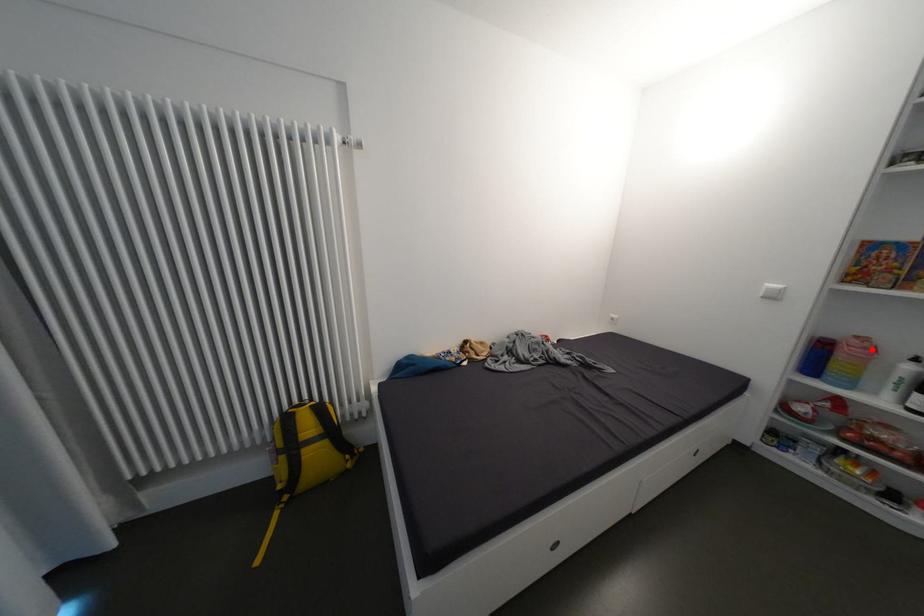
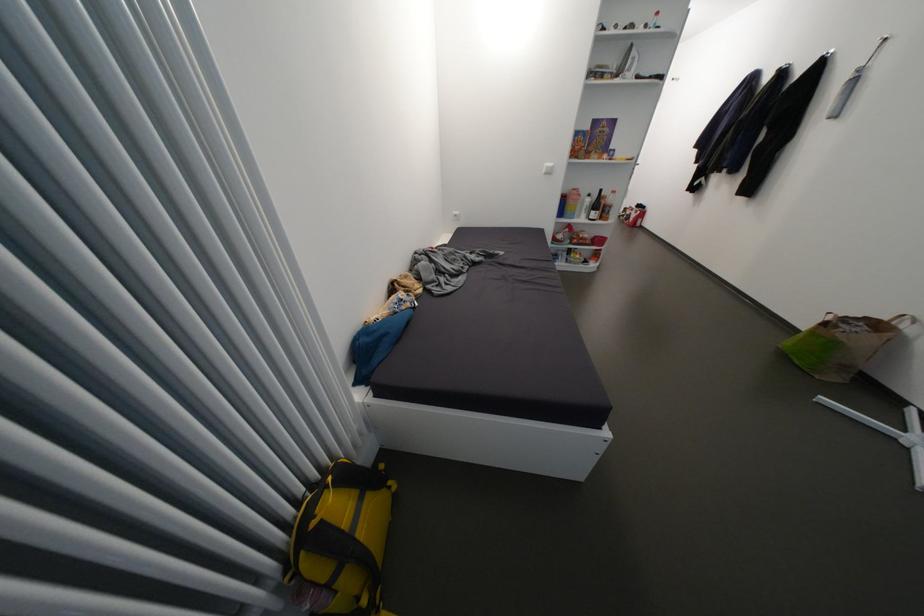
Question: A red point is marked in image1. In image2, is the corresponding 3D point closer to the camera or farther? Reply with the corresponding letter.

Choices:
 (A) The corresponding 3D point is closer.
 (B) The corresponding 3D point is farther.

Answer: (A)